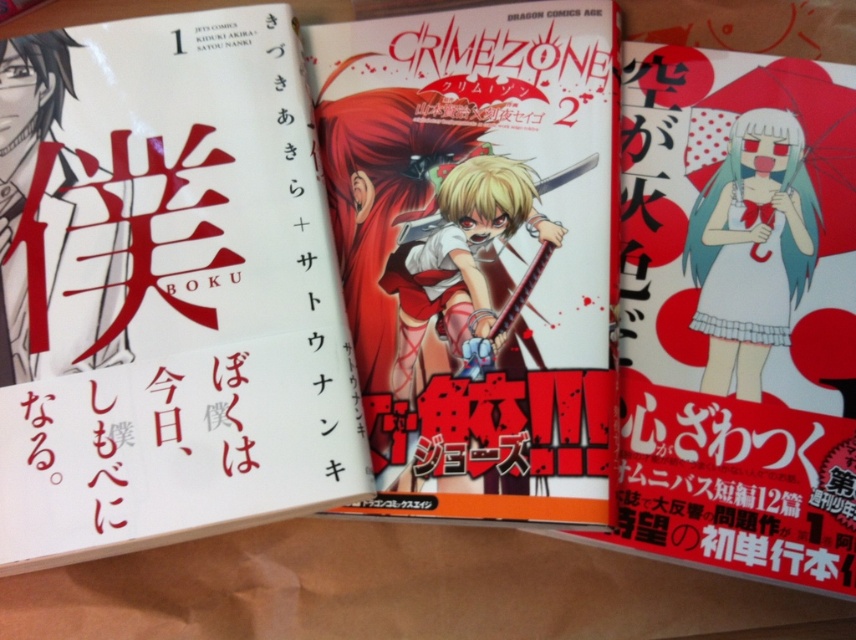
Does point (214, 513) come closer to viewer compared to point (397, 65)?

That is True.

The image size is (856, 640). In order to click on white matte book at center in this screenshot , I will do `click(165, 289)`.